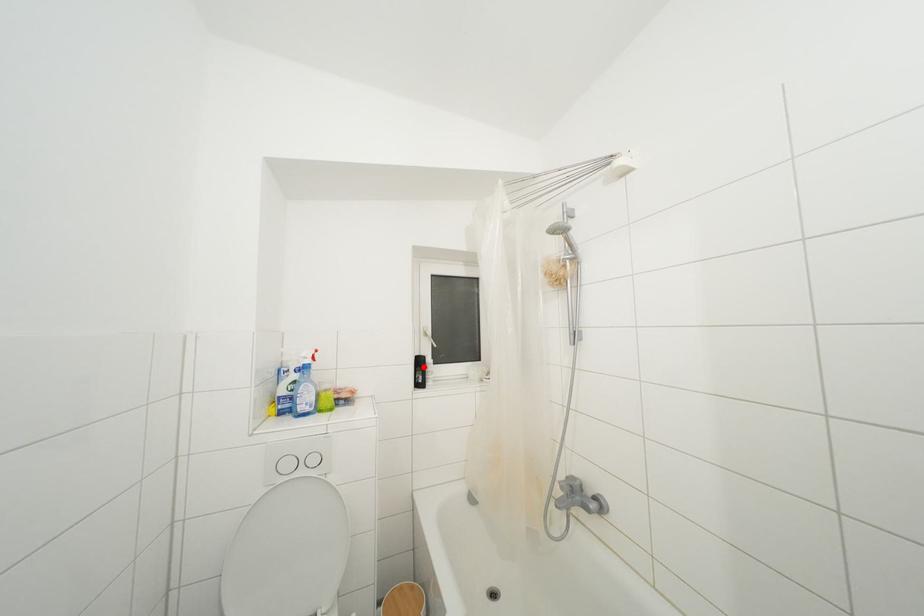
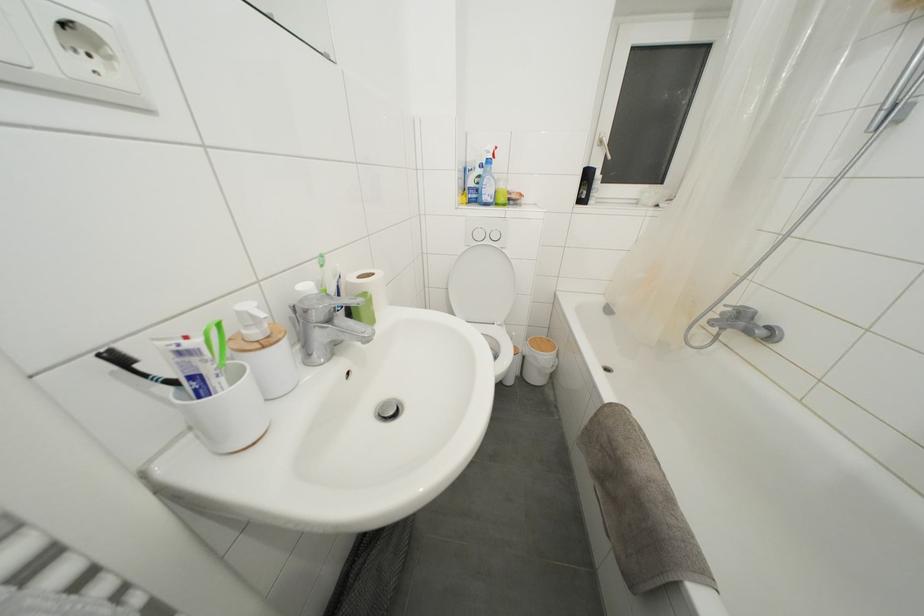
Locate, in the second image, the point that corresponds to the highlighted location in the first image.

(591, 180)